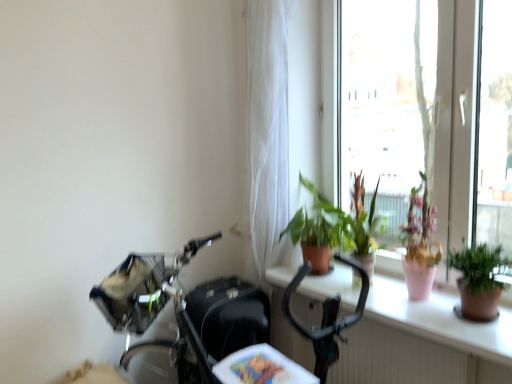
Question: Is terracotta pot at center inside or outside of black matte mountain bike at center?

Choices:
 (A) outside
 (B) inside

Answer: (A)

Question: From the image's perspective, relative to black matte mountain bike at center, is terracotta pot at center above or below?

Choices:
 (A) above
 (B) below

Answer: (A)

Question: Considering the real-world distances, which object is farthest from the transparent glass window at upper right?

Choices:
 (A) black matte mountain bike at center
 (B) white sheer curtain at upper center
 (C) green matte plant at upper right, the 2th houseplant when ordered from left to right
 (D) white plastic radiator at lower center
 (E) green matte plant at upper right, the second houseplant from the right

Answer: (A)

Question: Based on their relative distances, which object is nearer to the green matte plant at upper right, the second houseplant in the back-to-front sequence?

Choices:
 (A) white sheer curtain at upper center
 (B) white plastic radiator at lower center
 (C) transparent glass window at upper right
 (D) black matte mountain bike at center
 (E) terracotta pot at center

Answer: (E)